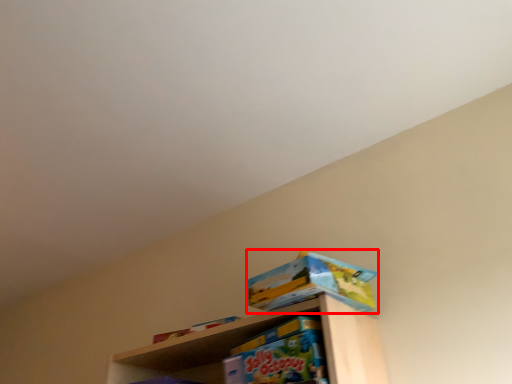
Question: From the image's perspective, what is the correct spatial positioning of toy (annotated by the red box) in reference to toy?

Choices:
 (A) below
 (B) above

Answer: (B)